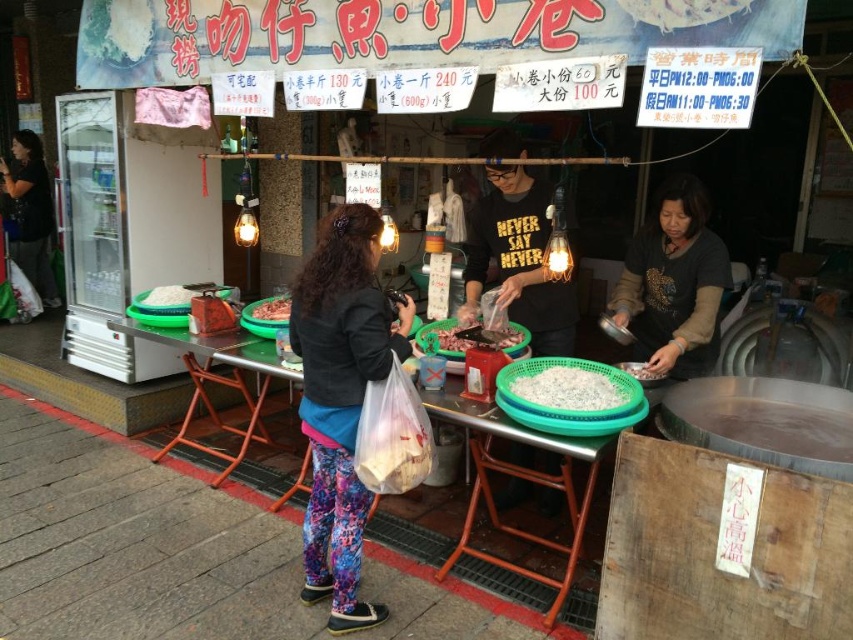
Question: Which point is farther from the camera taking this photo?

Choices:
 (A) pyautogui.click(x=630, y=371)
 (B) pyautogui.click(x=181, y=285)
 (C) pyautogui.click(x=39, y=180)

Answer: (C)

Question: Is pinkish matte meat at center smaller than white matte meat at center?

Choices:
 (A) no
 (B) yes

Answer: (B)

Question: Does green plastic table at center lie in front of floral leggings at lower center?

Choices:
 (A) yes
 (B) no

Answer: (A)

Question: Which point is closer to the camera?

Choices:
 (A) (167, 291)
 (B) (492, 416)
 (C) (561, 378)
 (D) (355, 496)

Answer: (D)

Question: Which of these objects is positioned farthest from the floral leggings at center?

Choices:
 (A) pinkish matte meat at center
 (B) white matte meat at center

Answer: (B)

Question: Is floral leggings at center below floral leggings at lower center?

Choices:
 (A) yes
 (B) no

Answer: (A)